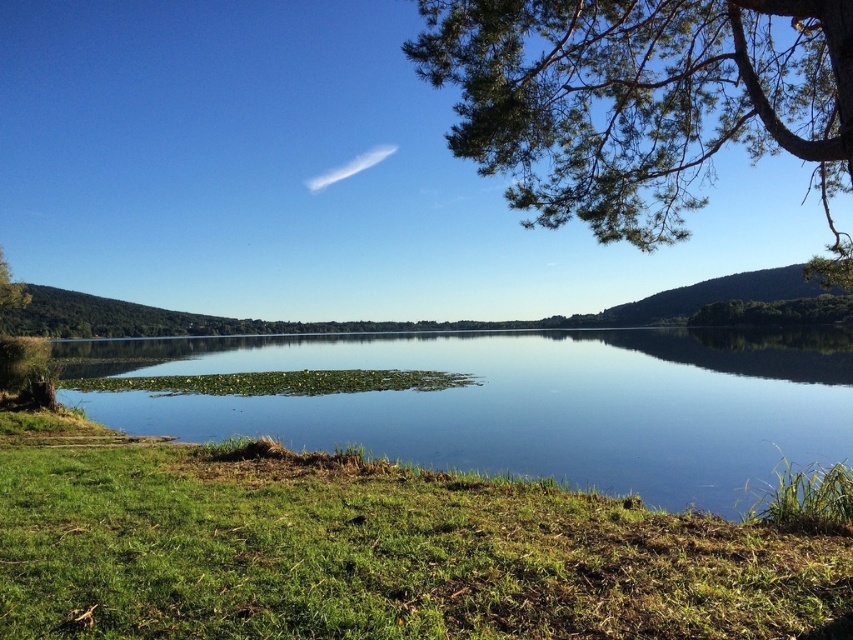
Question: Can you confirm if green grass at lower left is thinner than green leafy branches at upper right?

Choices:
 (A) yes
 (B) no

Answer: (A)

Question: Does green grass at lower left have a lesser width compared to green leafy branches at upper right?

Choices:
 (A) yes
 (B) no

Answer: (A)

Question: Which point is closer to the camera?

Choices:
 (A) (502, 93)
 (B) (344, 625)
 (C) (100, 369)

Answer: (B)

Question: Which object appears closest to the camera in this image?

Choices:
 (A) green leafy branches at upper right
 (B) green grass at lower left

Answer: (B)

Question: Which of the following is the farthest from the observer?

Choices:
 (A) clear blue water at center
 (B) green leafy branches at upper right
 (C) green grass at lower left

Answer: (A)

Question: Observing the image, what is the correct spatial positioning of green grass at lower left in reference to clear blue water at center?

Choices:
 (A) left
 (B) right

Answer: (B)